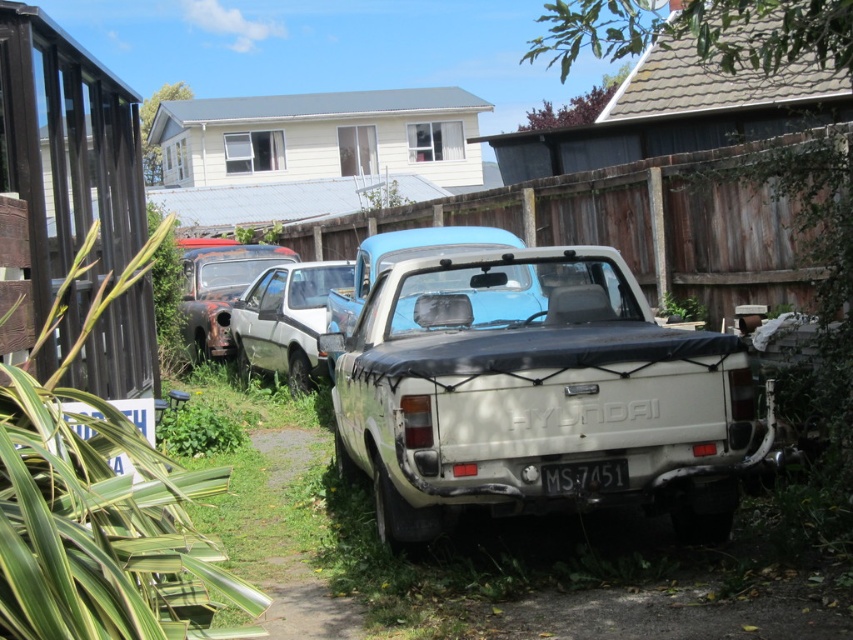
You are a delivery person trying to park your van between the white matte hatchback at center and the rusty metal car at left. Can your van, which is 2 meters wide, fit in the space between them?

The white matte hatchback at center is narrower than the rusty metal car at left, but the exact space between them isn